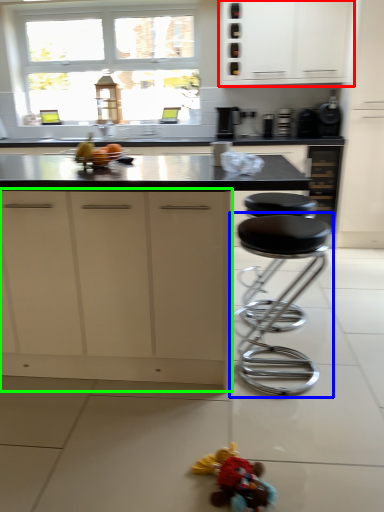
Question: Estimate the real-world distances between objects in this image. Which object is farther from cabinetry (highlighted by a red box), stool (highlighted by a blue box) or cabinetry (highlighted by a green box)?

Choices:
 (A) stool
 (B) cabinetry

Answer: (B)